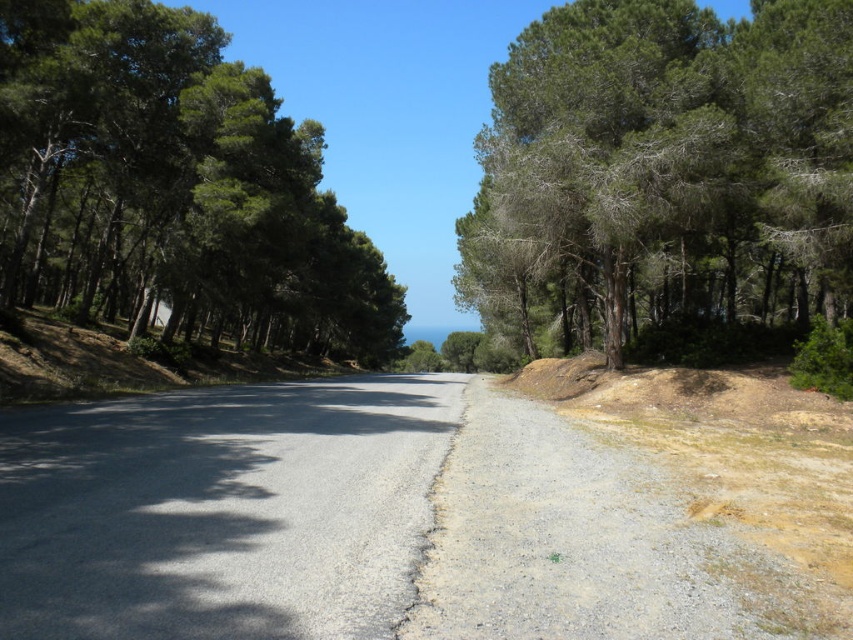
Is point (405, 634) positioned after point (775, 192)?

No, (405, 634) is in front of (775, 192).

Which is above, asphalt road at center or green needle-like foliage at upper right?

green needle-like foliage at upper right is above.

Is point (125, 616) positioned before point (680, 10)?

Yes, it is.

Locate an element on the screen. asphalt road at center is located at coordinates (361, 524).

Can you confirm if green needle-like foliage at upper right is bigger than green leafy trees at left?

No, green needle-like foliage at upper right is not bigger than green leafy trees at left.

Between point (842, 296) and point (123, 308), which one is positioned in front?

Point (842, 296) is in front.

Locate an element on the screen. green needle-like foliage at upper right is located at coordinates (662, 170).

Which is behind, point (428, 593) or point (123, 218)?

Point (123, 218)

Does asphalt road at center have a greater height compared to green leafy trees at left?

In fact, asphalt road at center may be shorter than green leafy trees at left.

Does point (637, 529) come behind point (86, 148)?

No, (637, 529) is closer to viewer.

At what (x,y) coordinates should I click in order to perform the action: click on asphalt road at center. Please return your answer as a coordinate pair (x, y). This screenshot has width=853, height=640. Looking at the image, I should click on (361, 524).